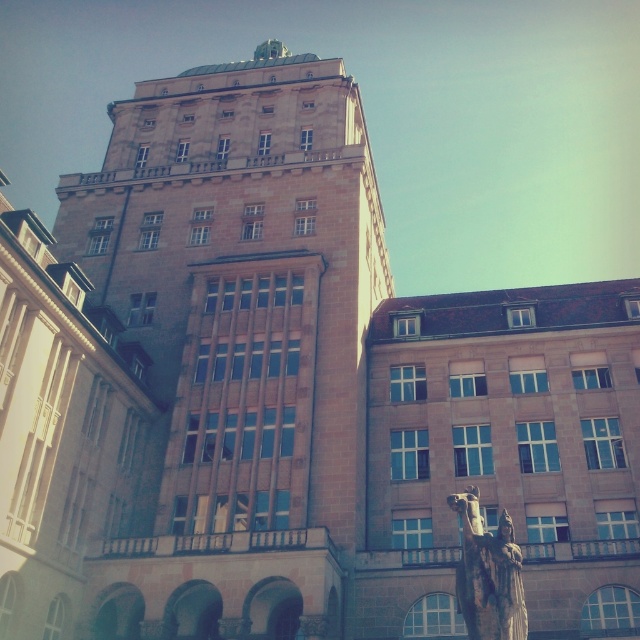
Is the position of brown stone tower at center more distant than that of bronze statue at center?

Yes, it is behind bronze statue at center.

Between point (320, 589) and point (472, 628), which one is positioned in front?

Point (472, 628) is more forward.

Find the location of a particular element. The height and width of the screenshot is (640, 640). brown stone tower at center is located at coordinates (236, 342).